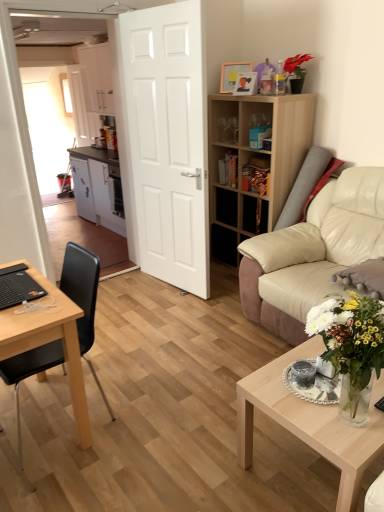
The image size is (384, 512). Find the location of `empty space that is ontop of light wood coffee table at lower right (from a real-world perspective)`. empty space that is ontop of light wood coffee table at lower right (from a real-world perspective) is located at coordinates (313, 390).